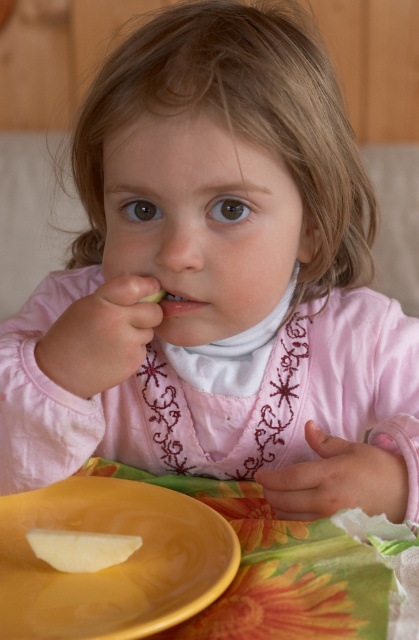
Does yellow matte plate at lower left appear on the right side of white matte apple slice at lower left?

Indeed, yellow matte plate at lower left is positioned on the right side of white matte apple slice at lower left.

Between point (64, 481) and point (77, 563), which one is positioned in front?

Point (77, 563)

This screenshot has height=640, width=419. In order to click on yellow matte plate at lower left in this screenshot , I will do `click(113, 564)`.

Identify the location of white matte apple slice at lower left. (80, 548).

This screenshot has width=419, height=640. I want to click on white matte apple slice at lower left, so click(x=80, y=548).

Identify the location of white matte apple slice at lower left. (80, 548).

Does yellow matte plate at lower left appear on the left side of matte pink lips at center?

Correct, you'll find yellow matte plate at lower left to the left of matte pink lips at center.

Is yellow matte plate at lower left to the right of matte pink lips at center from the viewer's perspective?

Incorrect, yellow matte plate at lower left is not on the right side of matte pink lips at center.

Who is more forward, (69,477) or (154,296)?

Point (154,296)

Locate an element on the screen. The width and height of the screenshot is (419, 640). yellow matte plate at lower left is located at coordinates (113, 564).